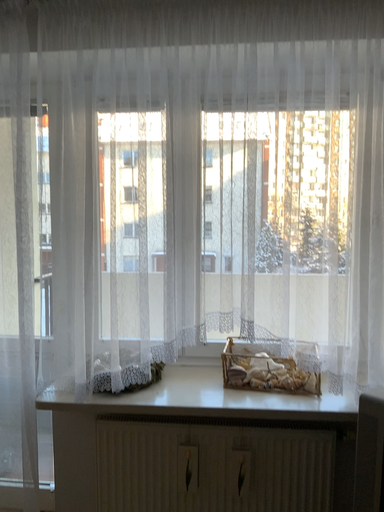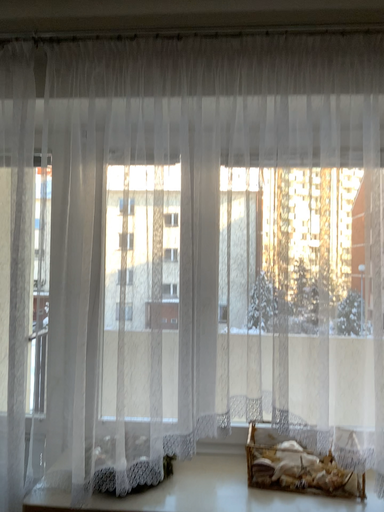
Question: Which way did the camera rotate in the video?

Choices:
 (A) rotated downward
 (B) rotated upward

Answer: (B)